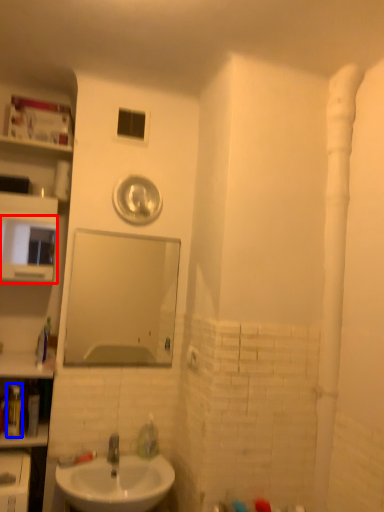
Question: Which point is closer to the camera, medicine cabinet (highlighted by a red box) or toiletry (highlighted by a blue box)?

Choices:
 (A) medicine cabinet
 (B) toiletry

Answer: (B)